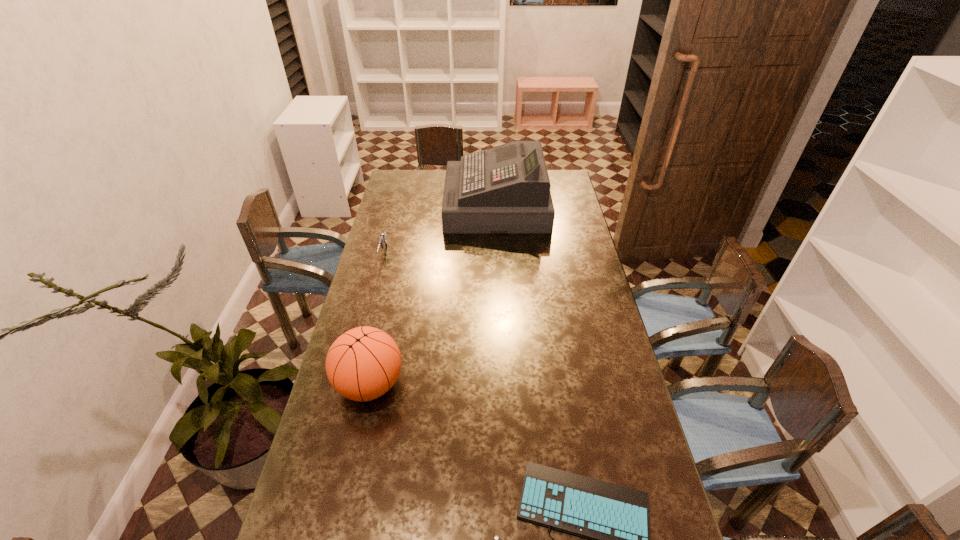
Find the location of a particular element. The image size is (960, 540). the farthest object is located at coordinates click(505, 189).

Find the location of a particular element. cash register is located at coordinates (505, 189).

At what (x,y) coordinates should I click in order to perform the action: click on the second nearest object. Please return your answer as a coordinate pair (x, y). This screenshot has height=540, width=960. Looking at the image, I should click on (362, 364).

At what (x,y) coordinates should I click in order to perform the action: click on the second tallest object. Please return your answer as a coordinate pair (x, y). This screenshot has width=960, height=540. Looking at the image, I should click on (362, 364).

Locate an element on the screen. This screenshot has width=960, height=540. the third tallest object is located at coordinates (382, 240).

Identify the location of the third nearest object. The width and height of the screenshot is (960, 540). (382, 240).

Where is `free space located 0.260m on the front-facing side of the cash register`? free space located 0.260m on the front-facing side of the cash register is located at coordinates (392, 205).

Find the location of a particular element. This screenshot has width=960, height=540. vacant space located on the front-facing side of the cash register is located at coordinates (436, 205).

You are a GUI agent. You are given a task and a screenshot of the screen. Output one action in this format:
    pyautogui.click(x=<x>, y=<y>)
    Task: Click on the free space located on the front-facing side of the cash register
    The width and height of the screenshot is (960, 540).
    Given the screenshot: What is the action you would take?
    pyautogui.click(x=392, y=205)

Locate an element on the screen. Image resolution: width=960 pixels, height=540 pixels. free point located on the front of the basketball is located at coordinates (357, 444).